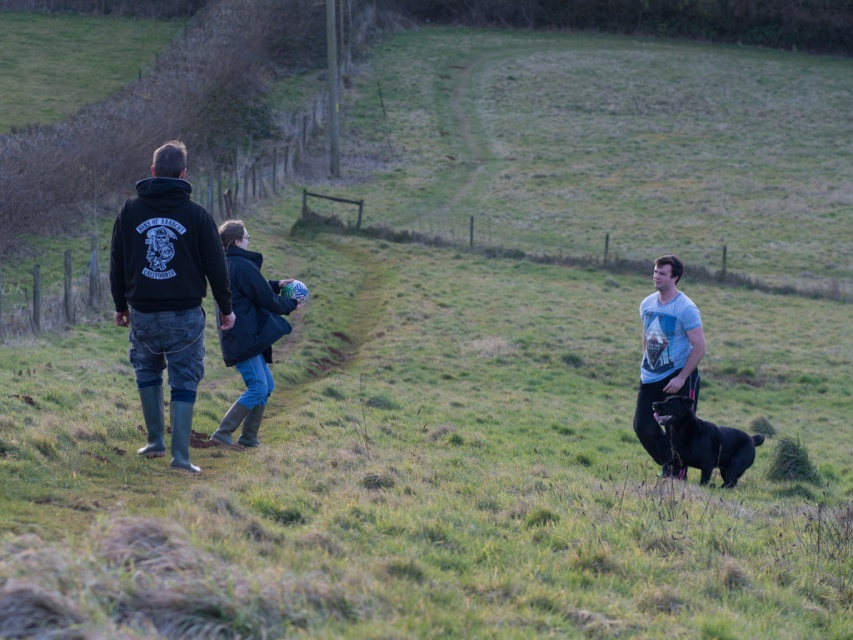
Question: Does dark blue denim jeans at center have a smaller size compared to shiny black dog at lower right?

Choices:
 (A) yes
 (B) no

Answer: (B)

Question: Among these objects, which one is farthest from the camera?

Choices:
 (A) black matte hoodie at left
 (B) dark blue denim jeans at center
 (C) shiny black dog at lower right
 (D) light blue t-shirt at center

Answer: (D)

Question: Based on their relative distances, which object is nearer to the light blue t-shirt at center?

Choices:
 (A) shiny black dog at lower right
 (B) black matte hoodie at left
 (C) dark blue denim jeans at center

Answer: (A)

Question: Does light blue t-shirt at center appear over shiny black dog at lower right?

Choices:
 (A) yes
 (B) no

Answer: (A)

Question: Which point is farther to the camera?

Choices:
 (A) (250, 340)
 (B) (671, 465)
 (C) (164, 196)
 (D) (733, 474)

Answer: (B)

Question: Does light blue t-shirt at center have a larger size compared to shiny black dog at lower right?

Choices:
 (A) yes
 (B) no

Answer: (A)